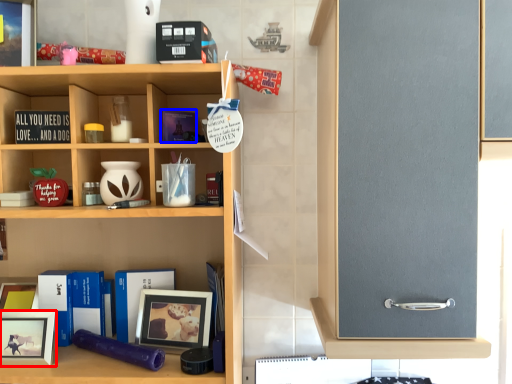
Question: Which object appears closest to the camera in this image, picture frame (highlighted by a red box) or book (highlighted by a blue box)?

Choices:
 (A) picture frame
 (B) book

Answer: (A)